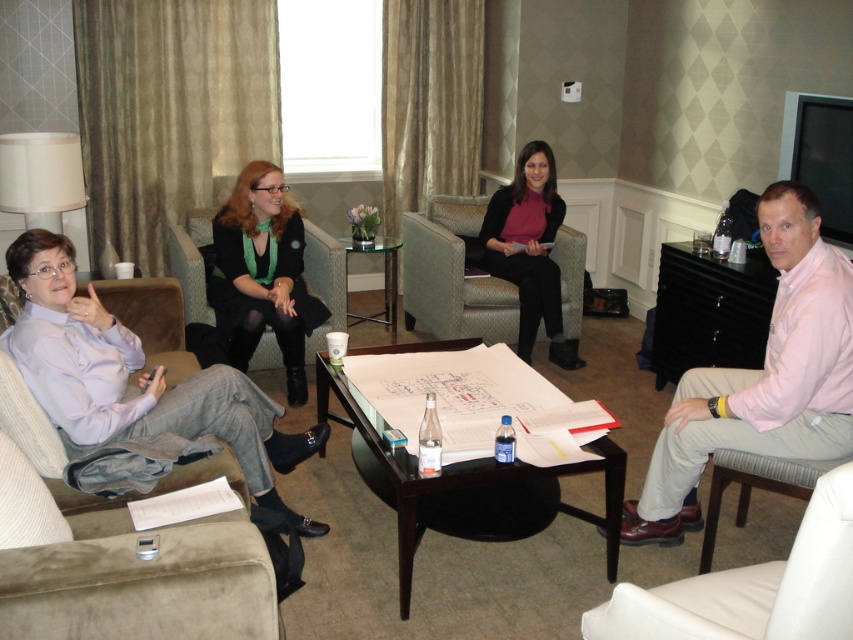
Can you confirm if suede couch at left is smaller than white leather chair at lower right?

Correct, suede couch at left occupies less space than white leather chair at lower right.

Which is more to the left, suede couch at left or white leather chair at lower right?

Positioned to the left is suede couch at left.

Is point (155, 330) in front of point (751, 572)?

No, it is behind (751, 572).

This screenshot has width=853, height=640. I want to click on suede couch at left, so click(x=132, y=556).

Between suede couch at left and pink cotton shirt at right, which one has more height?

pink cotton shirt at right is taller.

The image size is (853, 640). What do you see at coordinates (132, 556) in the screenshot? I see `suede couch at left` at bounding box center [132, 556].

Who is more forward, (271, 625) or (781, 404)?

Point (271, 625)

Where is `suede couch at left`? This screenshot has width=853, height=640. suede couch at left is located at coordinates (132, 556).

Based on the photo, does white leather chair at lower right appear on the right side of matte black jacket at center?

Indeed, white leather chair at lower right is positioned on the right side of matte black jacket at center.

Is white leather chair at lower right shorter than matte black jacket at center?

Yes.

Is point (584, 620) farther from viewer compared to point (259, 314)?

No, (584, 620) is in front of (259, 314).

This screenshot has height=640, width=853. In order to click on white leather chair at lower right in this screenshot , I will do `click(752, 588)`.